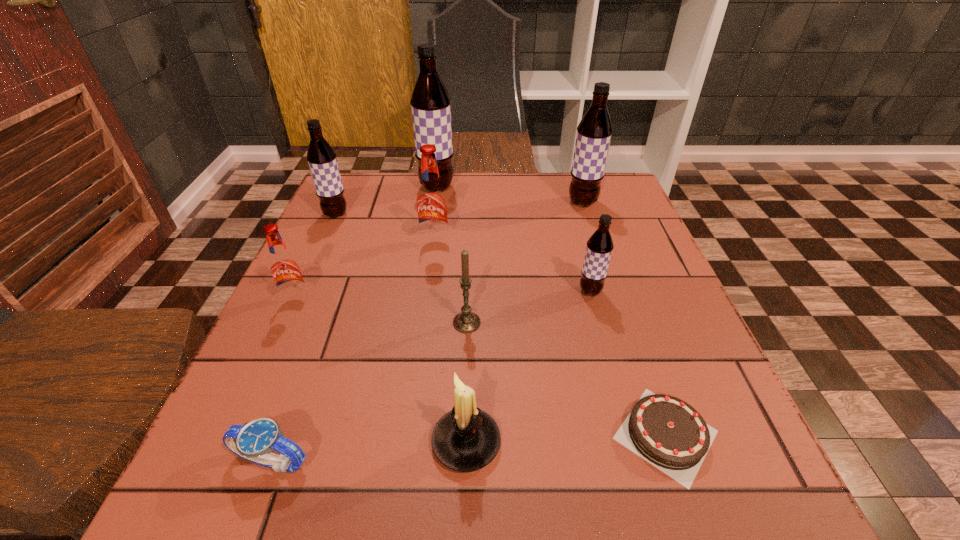
Identify the location of the tallest root beer. Image resolution: width=960 pixels, height=540 pixels. (430, 102).

In order to click on the biggest brown root beer in this screenshot , I will do `click(430, 102)`.

In order to click on the third smallest brown root beer in this screenshot , I will do `click(594, 131)`.

Find the location of a particular element. This screenshot has height=540, width=960. the ninth shortest object is located at coordinates (594, 131).

Identify the location of the right red root beer. (432, 207).

At what (x,y) coordinates should I click in order to perform the action: click on the farther red root beer. Please return your answer as a coordinate pair (x, y). This screenshot has height=540, width=960. Looking at the image, I should click on (432, 207).

Where is `the leftmost brown root beer`? the leftmost brown root beer is located at coordinates (321, 157).

This screenshot has height=540, width=960. What are the coordinates of `the smaller red root beer` in the screenshot? It's located at (284, 268).

Identify the location of the nearer red root beer. The width and height of the screenshot is (960, 540). (284, 268).

Find the location of a particular element. The height and width of the screenshot is (540, 960). the nearest brown root beer is located at coordinates (599, 247).